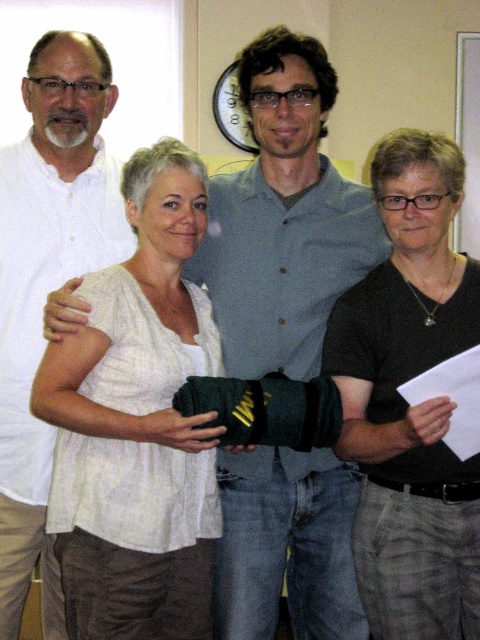
Question: From the image, what is the correct spatial relationship of white textured shirt at center in relation to matte white board at upper right?

Choices:
 (A) below
 (B) above

Answer: (A)

Question: Which object appears closest to the camera in this image?

Choices:
 (A) white cotton shirt at left
 (B) matte white board at upper right
 (C) white textured shirt at center
 (D) matte black shirt at center

Answer: (C)

Question: Is black matte shirt at right positioned behind white cotton shirt at left?

Choices:
 (A) yes
 (B) no

Answer: (B)

Question: Which point is closer to the camera?

Choices:
 (A) white cotton shirt at left
 (B) white textured shirt at center
 (C) black matte shirt at right
 (D) matte black shirt at center

Answer: (C)

Question: Which of these objects is positioned closest to the matte white board at upper right?

Choices:
 (A) black matte shirt at right
 (B) matte black shirt at center

Answer: (B)

Question: Can you confirm if white textured shirt at center is positioned to the left of black matte shirt at right?

Choices:
 (A) no
 (B) yes

Answer: (B)